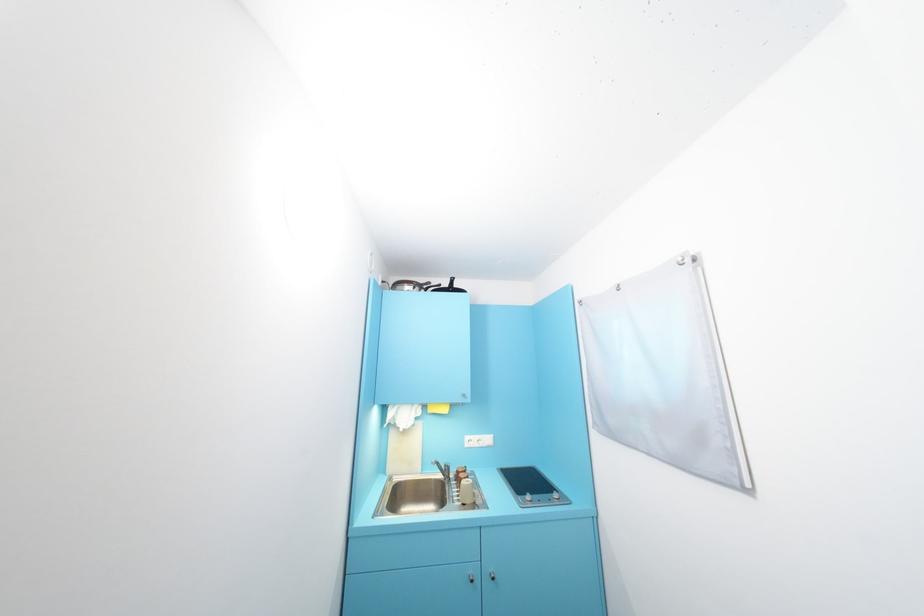
You are a GUI agent. You are given a task and a screenshot of the screen. Output one action in this format:
    pyautogui.click(x=<x>, y=<y>)
    Task: Click on the pot lid handle
    This screenshot has width=924, height=616.
    Given the screenshot: What is the action you would take?
    pyautogui.click(x=411, y=285)